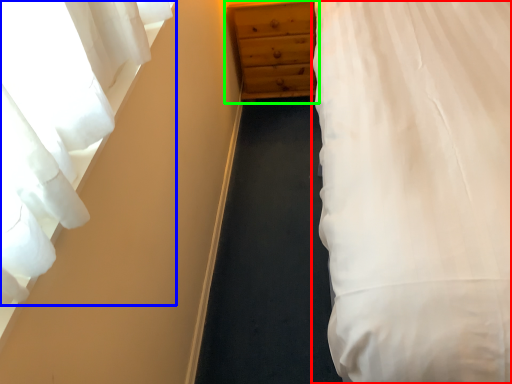
Question: Which object is the farthest from bed (highlighted by a red box)? Choose among these: curtain (highlighted by a blue box) or chest of drawers (highlighted by a green box).

Choices:
 (A) curtain
 (B) chest of drawers

Answer: (B)